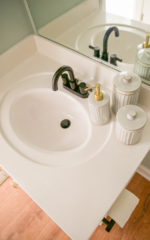
Where is `floor`? The height and width of the screenshot is (240, 150). floor is located at coordinates coord(37,221).